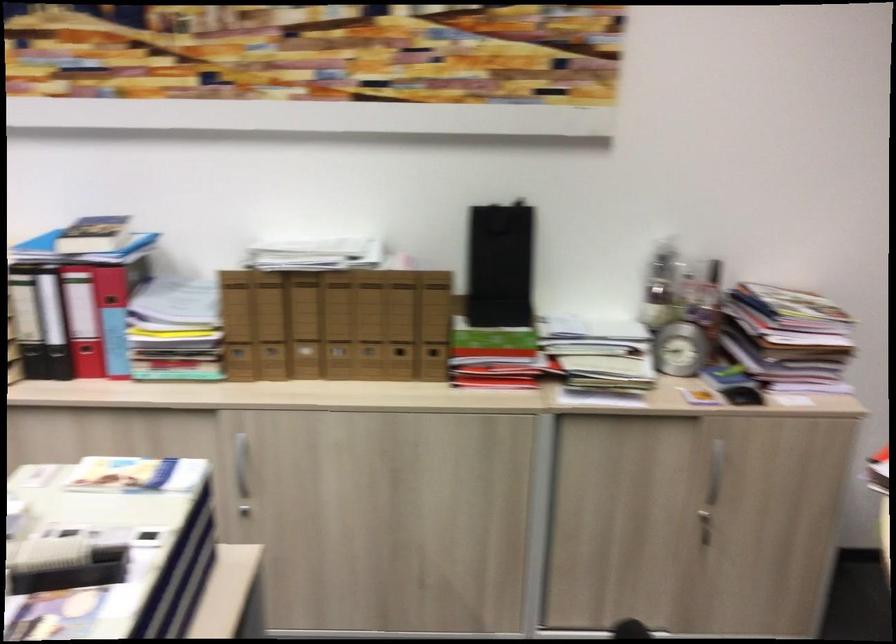
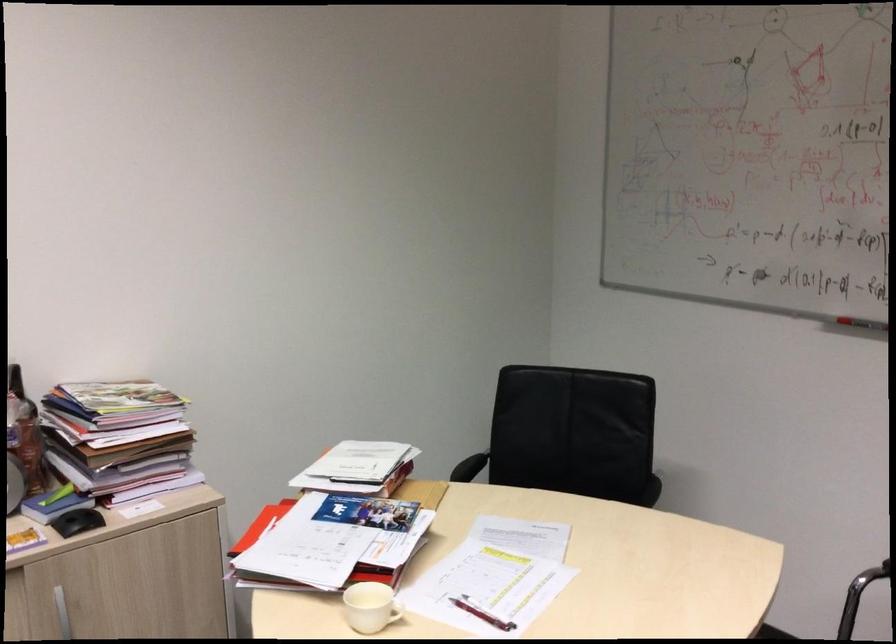
In the second image, find the point that corresponds to the point at 705,326 in the first image.

(23, 450)